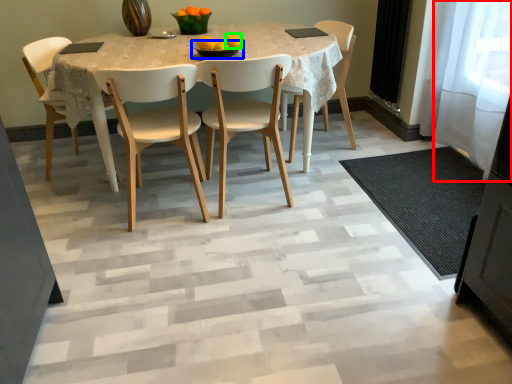
Question: Based on their relative distances, which object is farther from glass door (highlighted by a red box)? Choose from bowl (highlighted by a blue box) and orange (highlighted by a green box).

Choices:
 (A) bowl
 (B) orange

Answer: (A)